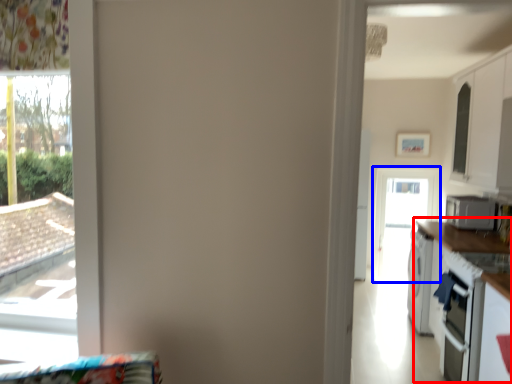
Question: Which point is further to the camera, counter top (highlighted by a red box) or screen door (highlighted by a blue box)?

Choices:
 (A) counter top
 (B) screen door

Answer: (B)